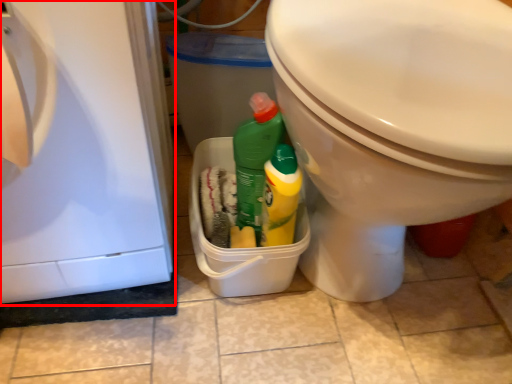
Question: Where is dish washer (annotated by the red box) located in relation to toilet in the image?

Choices:
 (A) right
 (B) left

Answer: (B)